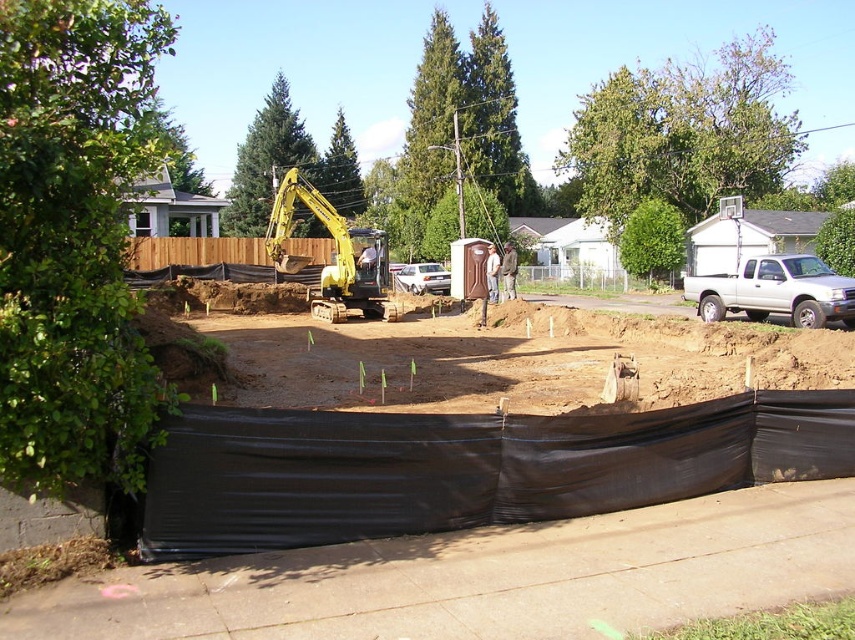
You are standing at the construction site and want to reach the point marked at coordinates point (565, 369). Given that the excavator is currently operating 15 meters away from your position, can you safely walk to the point without entering the excavator operator zone, which is defined as a 10 meter radius around the excavator?

The distance between you and the point marked at coordinates point (565, 369) is 12.34 meters. Since the excavator is operating 15 meters away from your position, the excavator operator zone extends up to 10 meters from it. Therefore, the closest you can get to the excavator is 15 meters minus 10 meters equals 5 meters. Since the point is 12.34 meters away from you, which is beyond the 5 meter minimum distance from the excavator, you can safely walk to the point without entering the operator zone.

You are a construction worker who needs to move the yellow rubber excavator at center to the left side of the black plastic tarp at center. Based on their current positions, which direction should you move the excavator to achieve this?

The black plastic tarp at center is currently to the right of the yellow rubber excavator at center. To move the excavator to the left side of the black plastic tarp at center, you should move it to the left so that the excavator ends up on the left side relative to the tarp.

You are a construction supervisor checking the site layout. You need to determine if the black plastic tarp at center can be moved to a storage area without disturbing the yellow rubber excavator at center. Can it be moved based on their sizes?

The black plastic tarp at center occupies less space than the yellow rubber excavator at center, so it can be moved without disturbing the excavator since it is smaller in size.